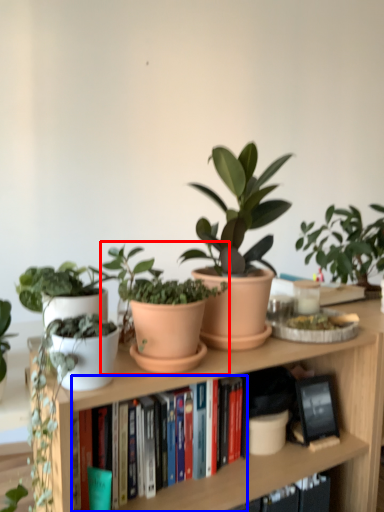
Question: Which object is closer to the camera taking this photo, houseplant (highlighted by a red box) or book (highlighted by a blue box)?

Choices:
 (A) houseplant
 (B) book

Answer: (A)